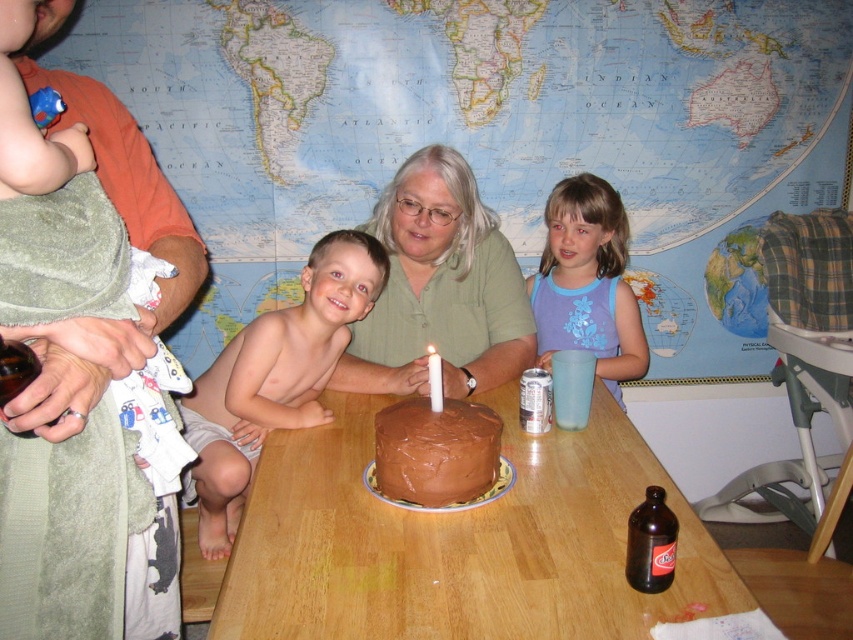
Which is more to the right, brown wooden table at center or soft cotton towel at upper left?

From the viewer's perspective, brown wooden table at center appears more on the right side.

Who is taller, brown wooden table at center or soft cotton towel at upper left?

soft cotton towel at upper left is taller.

Does point (381, 550) come in front of point (22, 566)?

No, (381, 550) is behind (22, 566).

In order to click on brown wooden table at center in this screenshot , I will do `click(460, 541)`.

Does chocolate matte cake at center have a greater width compared to white wax candle at center?

Yes, chocolate matte cake at center is wider than white wax candle at center.

In the scene shown: Which is more to the right, chocolate matte cake at center or white wax candle at center?

From the viewer's perspective, white wax candle at center appears more on the right side.

Between point (432, 449) and point (433, 387), which one is positioned in front?

Point (432, 449)

At what (x,y) coordinates should I click in order to perform the action: click on chocolate matte cake at center. Please return your answer as a coordinate pair (x, y). The width and height of the screenshot is (853, 640). Looking at the image, I should click on (436, 451).

Is green matte shirt at center to the left of blue cotton shirt at upper right from the viewer's perspective?

Yes, green matte shirt at center is to the left of blue cotton shirt at upper right.

Find the location of a particular element. This screenshot has width=853, height=640. green matte shirt at center is located at coordinates (439, 288).

What do you see at coordinates (439, 288) in the screenshot? This screenshot has height=640, width=853. I see `green matte shirt at center` at bounding box center [439, 288].

The image size is (853, 640). In order to click on green matte shirt at center in this screenshot , I will do pyautogui.click(x=439, y=288).